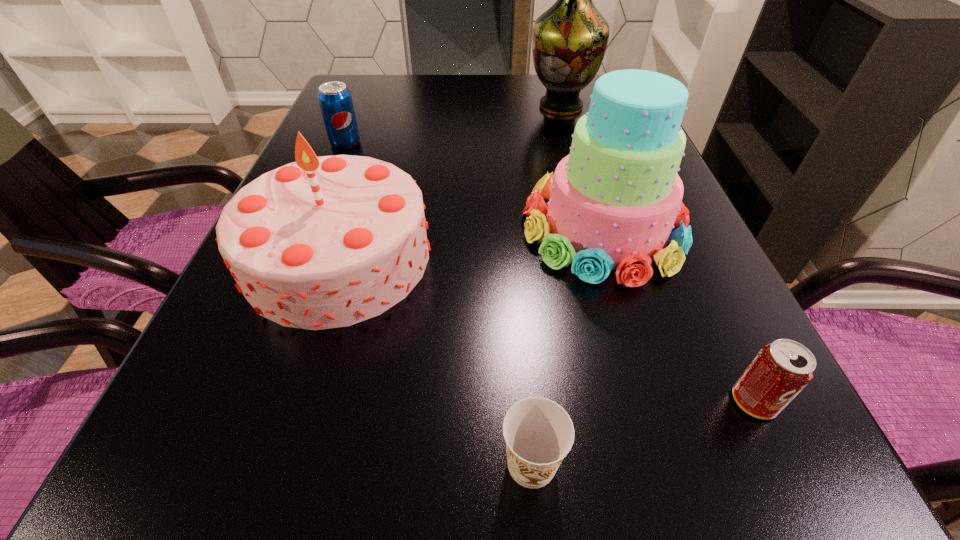
This screenshot has height=540, width=960. I want to click on blank area in the image that satisfies the following two spatial constraints: 1. on the back side of the cake; 2. on the right side of the birthday cake, so click(x=348, y=227).

This screenshot has width=960, height=540. I want to click on vacant region that satisfies the following two spatial constraints: 1. on the back side of the farthest object; 2. on the left side of the left soda can, so click(x=361, y=106).

Locate an element on the screen. This screenshot has width=960, height=540. free space in the image that satisfies the following two spatial constraints: 1. on the back side of the shorter soda can; 2. on the right side of the shortest object is located at coordinates coord(526,401).

Where is `vacant area in the image that satisfies the following two spatial constraints: 1. on the front side of the farther soda can; 2. on the right side of the cake`? This screenshot has width=960, height=540. vacant area in the image that satisfies the following two spatial constraints: 1. on the front side of the farther soda can; 2. on the right side of the cake is located at coordinates (310, 227).